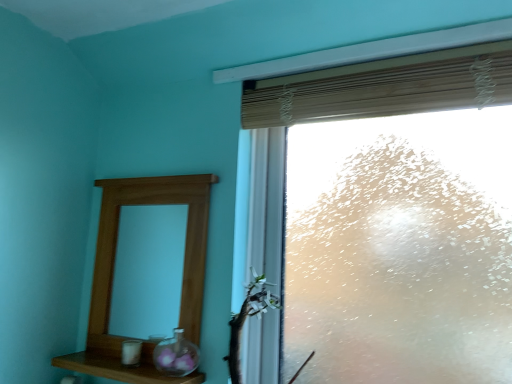
Question: Is point (262, 329) positioned closer to the camera than point (236, 362)?

Choices:
 (A) farther
 (B) closer

Answer: (A)

Question: Based on their sizes in the image, would you say frosted glass window at upper right is bigger or smaller than green leafy branch at lower right?

Choices:
 (A) big
 (B) small

Answer: (A)

Question: Which is nearer to the frosted glass window at upper right?

Choices:
 (A) wooden blind at upper right
 (B) transparent glass vase at lower center
 (C) green leafy branch at lower right
 (D) wooden shelf at lower left
 (E) wooden mirror at left

Answer: (A)

Question: Estimate the real-world distances between objects in this image. Which object is closer to the green leafy branch at lower right?

Choices:
 (A) frosted glass window at upper right
 (B) wooden mirror at left
 (C) wooden blind at upper right
 (D) transparent glass vase at lower center
 (E) wooden shelf at lower left

Answer: (D)